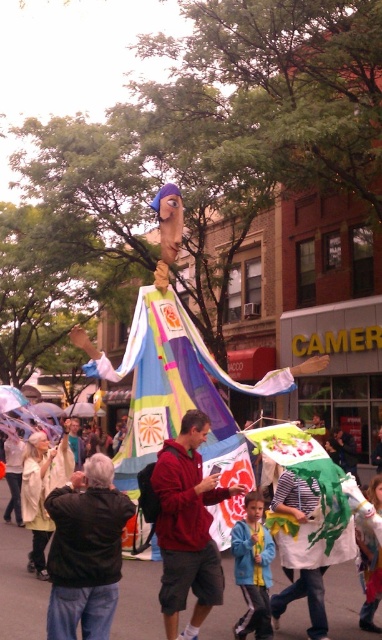
You are a photographer standing at the edge of the parade crowd. You want to take a photo of both the matte black jacket at center and the blue denim jacket at center in the same frame. Given that your camera has a minimum focus distance of 2 meters, will you be able to capture both jackets in the shot?

The distance between the matte black jacket at center and the blue denim jacket at center is 2.10 meters, which is just over the camera minimum focus distance of 2 meters. Therefore, you can capture both jackets in the same frame.

A person wearing a matte black jacket at center is standing in the street during the parade. If the camera is positioned 10 meters away from them, will they be in focus if the camera has a depth of field that can only capture objects within 9 meters?

The matte black jacket at center is 9.45 meters from the camera, which is beyond the camera depth of field of 9 meters. Therefore, the person wearing the matte black jacket at center will be out of focus.

You are standing at the edge of the parade crowd and see the point marked as point (19, 584). What object does this point correspond to in the scene?

The point (19, 584) corresponds to the matte black jacket at center.